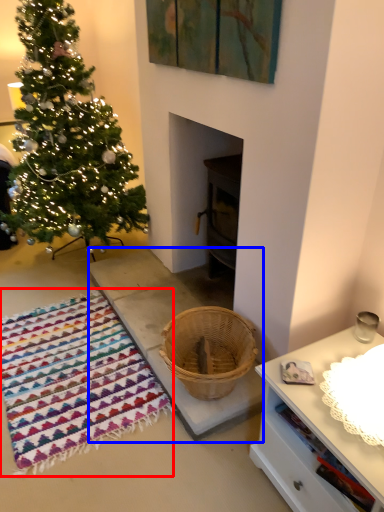
Question: Among these objects, which one is nearest to the camera, blanket (highlighted by a red box) or concrete (highlighted by a blue box)?

Choices:
 (A) blanket
 (B) concrete

Answer: (A)